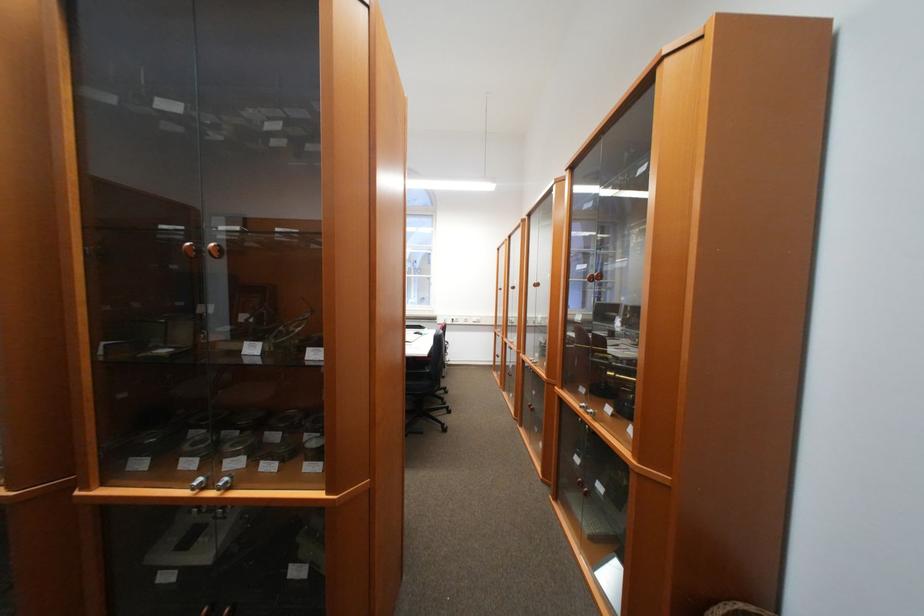
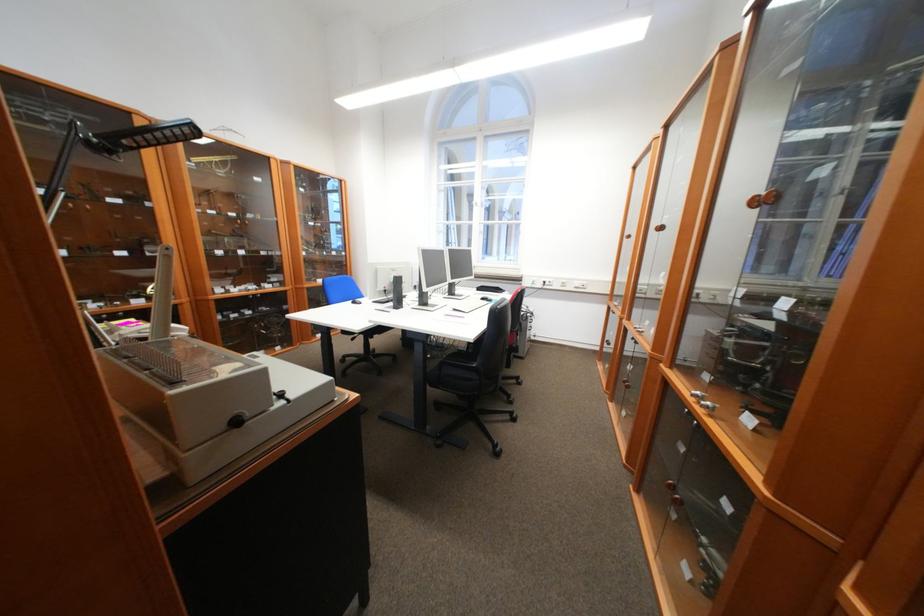
Find the pixel in the second image that matches (x=468, y=323) in the first image.

(562, 286)